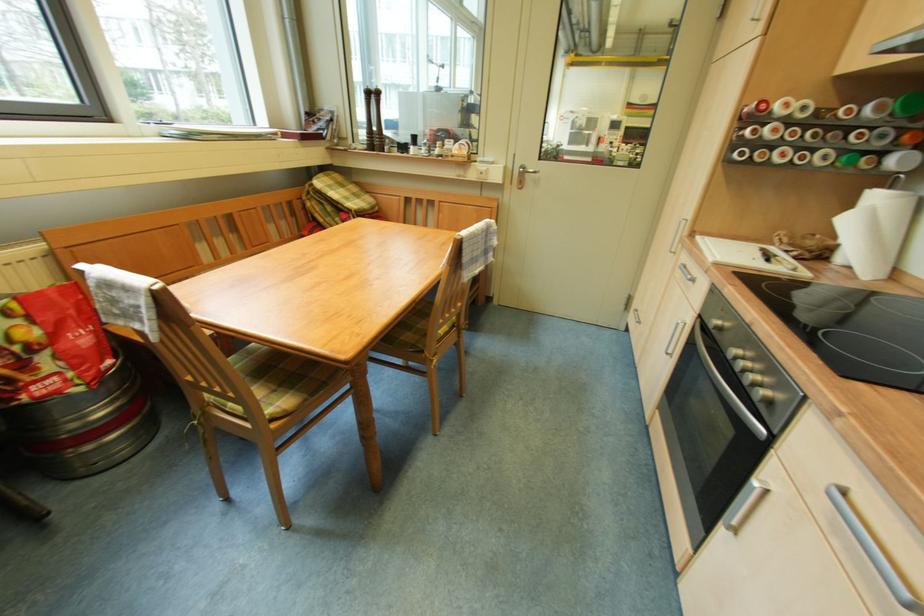
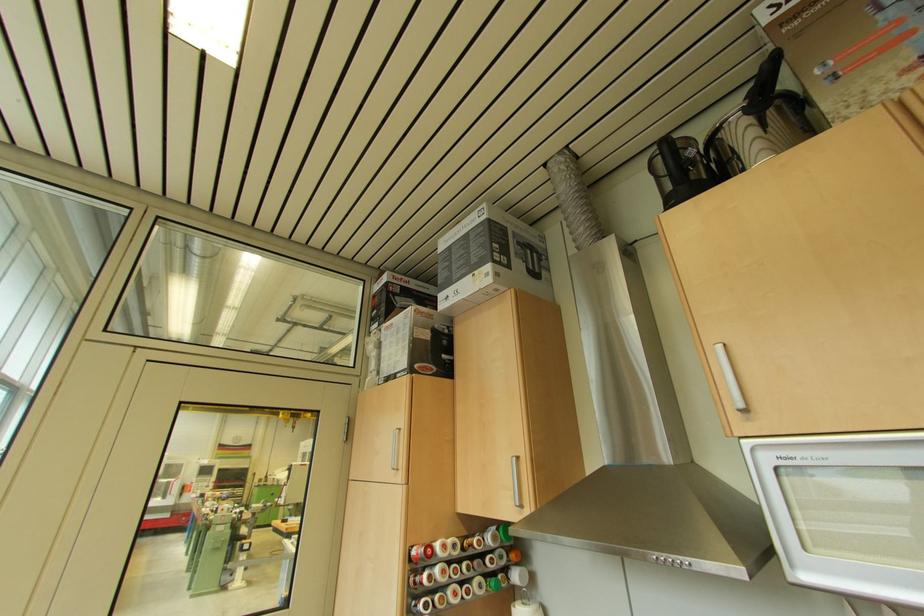
Where in the second image is the point corresponding to (x=849, y=73) from the first image?

(468, 513)